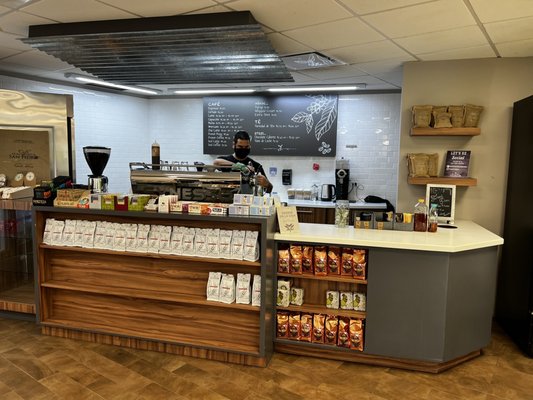
Locate an element on the screen. espresso maker is located at coordinates (209, 174).